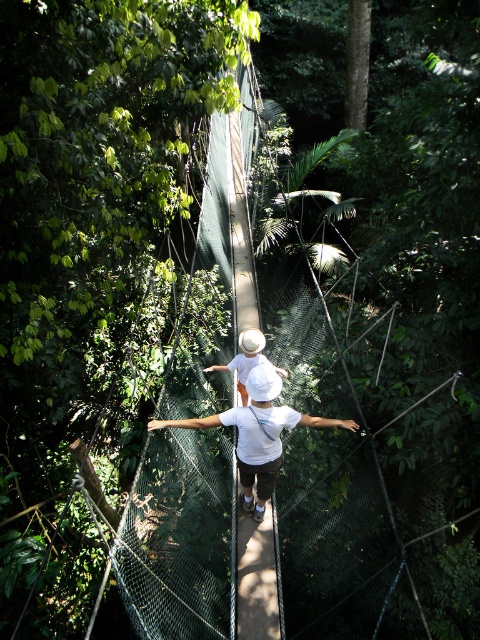
Is white matte shirt at center to the right of white matte hat at center from the viewer's perspective?

Indeed, white matte shirt at center is positioned on the right side of white matte hat at center.

Does white matte shirt at center come in front of white matte hat at center?

Yes, it is.

Is point (333, 424) positioned behind point (235, 356)?

No, it is not.

Locate an element on the screen. The height and width of the screenshot is (640, 480). white matte shirt at center is located at coordinates (257, 426).